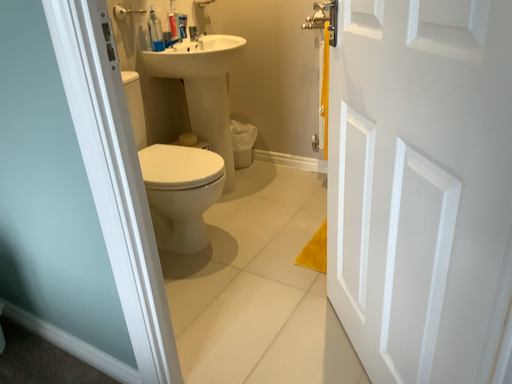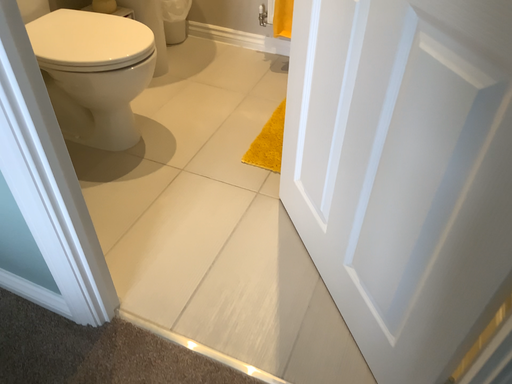
Question: How did the camera likely rotate when shooting the video?

Choices:
 (A) rotated left
 (B) rotated right

Answer: (B)